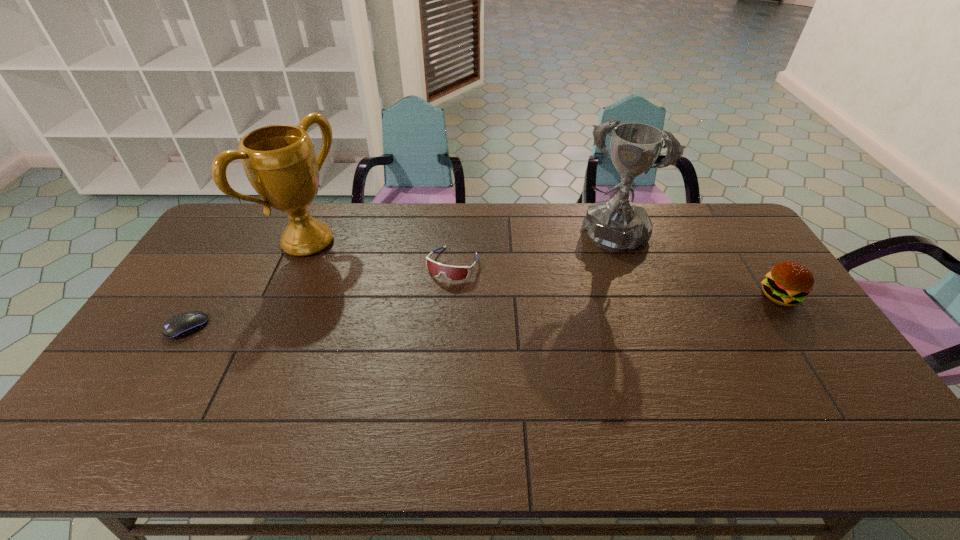
Find the location of a particular element. This screenshot has height=540, width=960. vacant space that satisfies the following two spatial constraints: 1. on the back side of the left award; 2. on the right side of the computer mouse is located at coordinates (239, 242).

The width and height of the screenshot is (960, 540). Find the location of `free region that satisfies the following two spatial constraints: 1. on the back side of the left award; 2. on the right side of the right award`. free region that satisfies the following two spatial constraints: 1. on the back side of the left award; 2. on the right side of the right award is located at coordinates 310,236.

The height and width of the screenshot is (540, 960). Find the location of `free space that satisfies the following two spatial constraints: 1. on the back side of the shortest object; 2. on the left side of the goggles`. free space that satisfies the following two spatial constraints: 1. on the back side of the shortest object; 2. on the left side of the goggles is located at coordinates (226, 264).